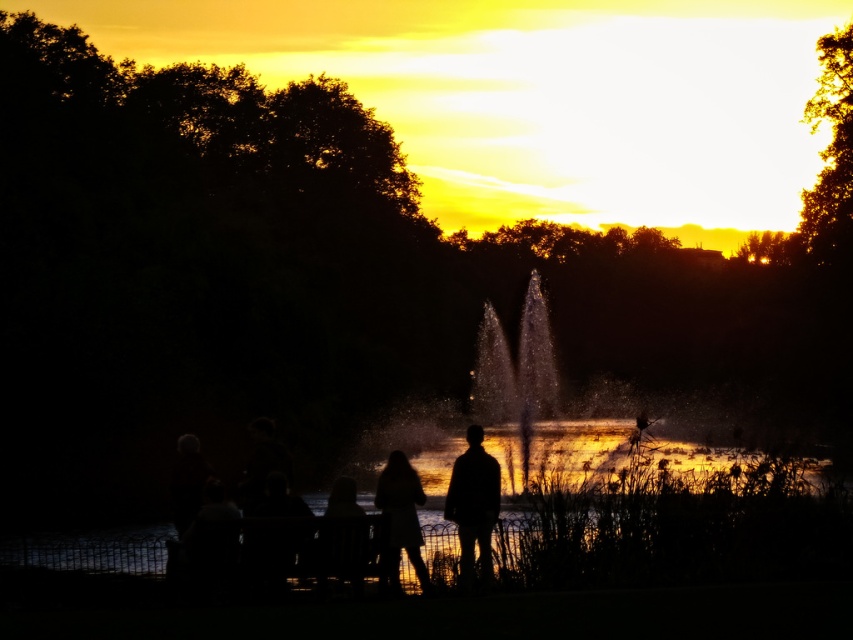
Question: Which point is closer to the camera?

Choices:
 (A) silhouette hair at center
 (B) silhouette fabric person at lower center
 (C) silhouette figure at center

Answer: (B)

Question: Can you confirm if silhouette hair at center is positioned below silhouette fabric person at lower center?

Choices:
 (A) yes
 (B) no

Answer: (B)

Question: Does silhouette hair at center have a smaller size compared to silhouette fabric person at lower center?

Choices:
 (A) yes
 (B) no

Answer: (B)

Question: Is silhouette figure at center wider than silhouette fabric person at lower center?

Choices:
 (A) yes
 (B) no

Answer: (A)

Question: Among these objects, which one is farthest from the camera?

Choices:
 (A) silhouette hair at center
 (B) silhouette figure at center
 (C) silhouette fabric person at lower center

Answer: (A)

Question: Which point appears closest to the camera in this image?

Choices:
 (A) (335, 500)
 (B) (398, 529)

Answer: (A)